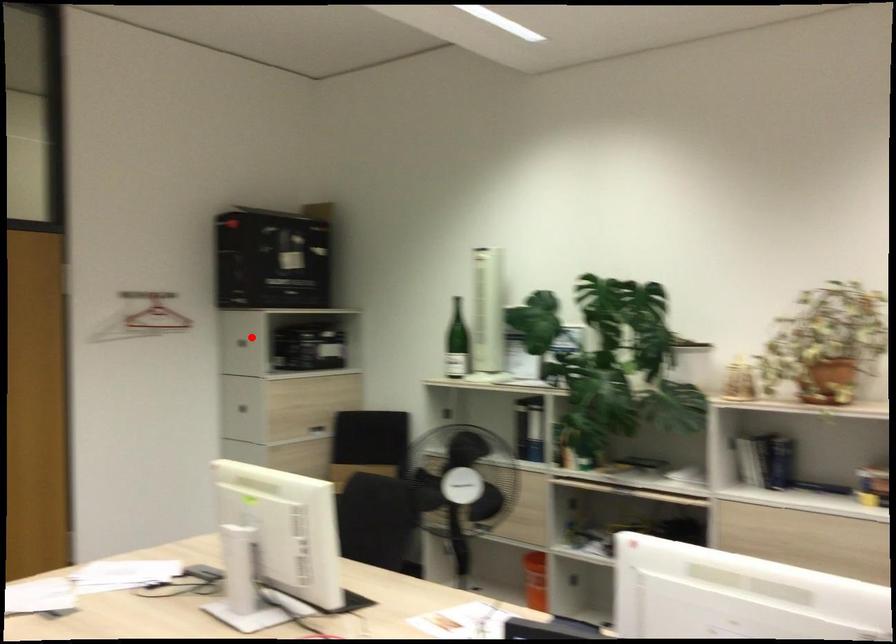
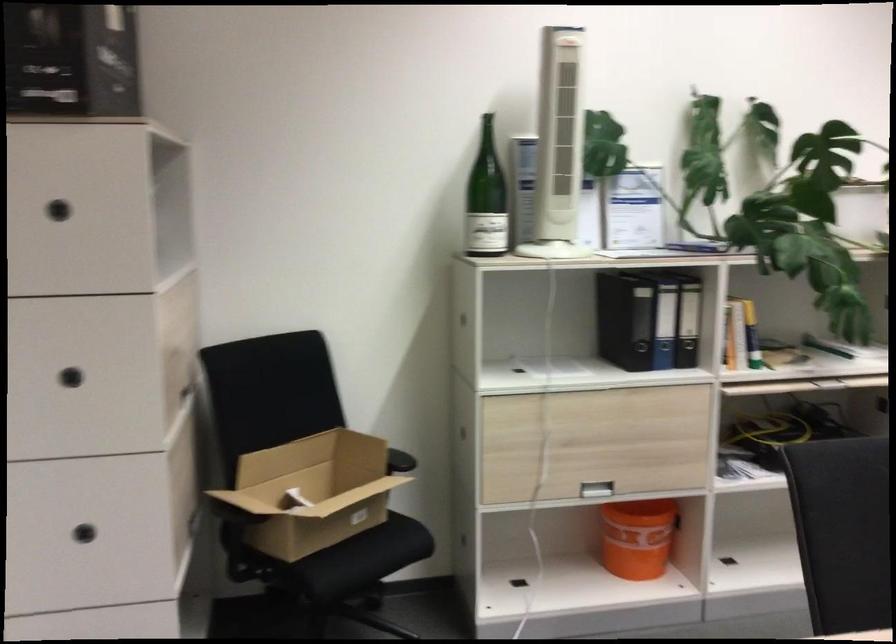
The point at the highlighted location is marked in the first image. Where is the corresponding point in the second image?

(59, 210)